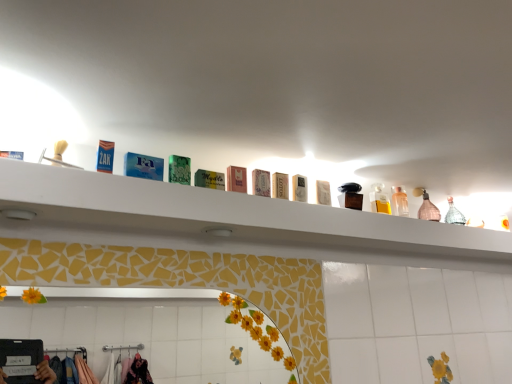
Question: Can you confirm if matte pink soap at center, which ranks as the third toiletry in front-to-back order, is thinner than clear plastic bottle at upper right, which appears as the first toiletry when viewed from the back?

Choices:
 (A) yes
 (B) no

Answer: (A)

Question: Considering the relative sizes of matte pink soap at center, which ranks as the third toiletry in front-to-back order, and clear plastic bottle at upper right, the 1th toiletry positioned from the right, in the image provided, is matte pink soap at center, which ranks as the third toiletry in front-to-back order, shorter than clear plastic bottle at upper right, the 1th toiletry positioned from the right,?

Choices:
 (A) no
 (B) yes

Answer: (B)

Question: Is matte pink soap at center, which ranks as the third toiletry in front-to-back order, positioned before clear plastic bottle at upper right, which appears as the first toiletry when viewed from the back?

Choices:
 (A) yes
 (B) no

Answer: (A)

Question: From the image's perspective, is matte pink soap at center, which ranks as the third toiletry in front-to-back order, on top of clear plastic bottle at upper right, the 8th toiletry positioned from the front?

Choices:
 (A) yes
 (B) no

Answer: (A)

Question: Is matte pink soap at center, which ranks as the third toiletry in front-to-back order, located outside clear plastic bottle at upper right, marked as the 8th toiletry in a left-to-right arrangement?

Choices:
 (A) no
 (B) yes

Answer: (B)

Question: Based on their sizes in the image, would you say white matte soap at center, acting as the 2th toiletry starting from the right, is bigger or smaller than blue cardboard box at upper left, the eighth toiletry from the right?

Choices:
 (A) big
 (B) small

Answer: (A)

Question: Considering their positions, is white matte soap at center, the 2th toiletry when ordered from back to front, located in front of or behind blue cardboard box at upper left, arranged as the first toiletry when viewed from the front?

Choices:
 (A) behind
 (B) front

Answer: (A)

Question: Which is correct: white matte soap at center, the 2th toiletry when ordered from back to front, is inside blue cardboard box at upper left, marked as the first toiletry in a left-to-right arrangement, or outside of it?

Choices:
 (A) inside
 (B) outside

Answer: (B)

Question: Considering the positions of point (316, 190) and point (102, 142), is point (316, 190) closer or farther from the camera than point (102, 142)?

Choices:
 (A) closer
 (B) farther

Answer: (B)

Question: Considering the positions of white matte soap at center, the 3th toiletry when ordered from back to front, and clear plastic bottle at upper right, the 1th toiletry positioned from the right, in the image, is white matte soap at center, the 3th toiletry when ordered from back to front, taller or shorter than clear plastic bottle at upper right, the 1th toiletry positioned from the right,?

Choices:
 (A) tall
 (B) short

Answer: (B)

Question: Is point (297, 180) positioned closer to the camera than point (395, 188)?

Choices:
 (A) farther
 (B) closer

Answer: (B)

Question: Looking at their shapes, would you say white matte soap at center, which is the sixth toiletry from front to back, is wider or thinner than clear plastic bottle at upper right, marked as the 8th toiletry in a left-to-right arrangement?

Choices:
 (A) wide
 (B) thin

Answer: (B)

Question: Is white matte soap at center, the 3th toiletry when ordered from back to front, bigger or smaller than clear plastic bottle at upper right, marked as the 8th toiletry in a left-to-right arrangement?

Choices:
 (A) big
 (B) small

Answer: (B)

Question: Based on their sizes in the image, would you say blue cardboard box at upper left, arranged as the first toiletry when viewed from the front, is bigger or smaller than pink glass bottle at upper right?

Choices:
 (A) big
 (B) small

Answer: (B)

Question: From their relative heights in the image, would you say blue cardboard box at upper left, the eighth toiletry from the right, is taller or shorter than pink glass bottle at upper right?

Choices:
 (A) tall
 (B) short

Answer: (B)